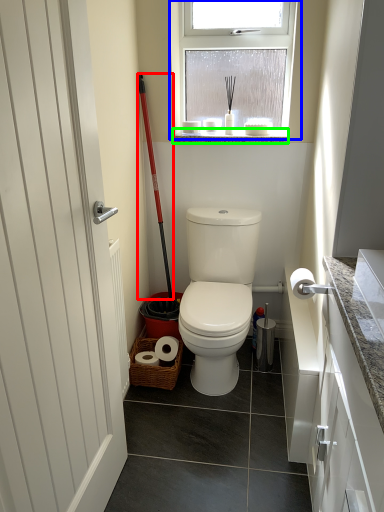
Question: Which object is the closest to the shovel (highlighted by a red box)? Choose among these: window (highlighted by a blue box) or window sill (highlighted by a green box).

Choices:
 (A) window
 (B) window sill

Answer: (B)